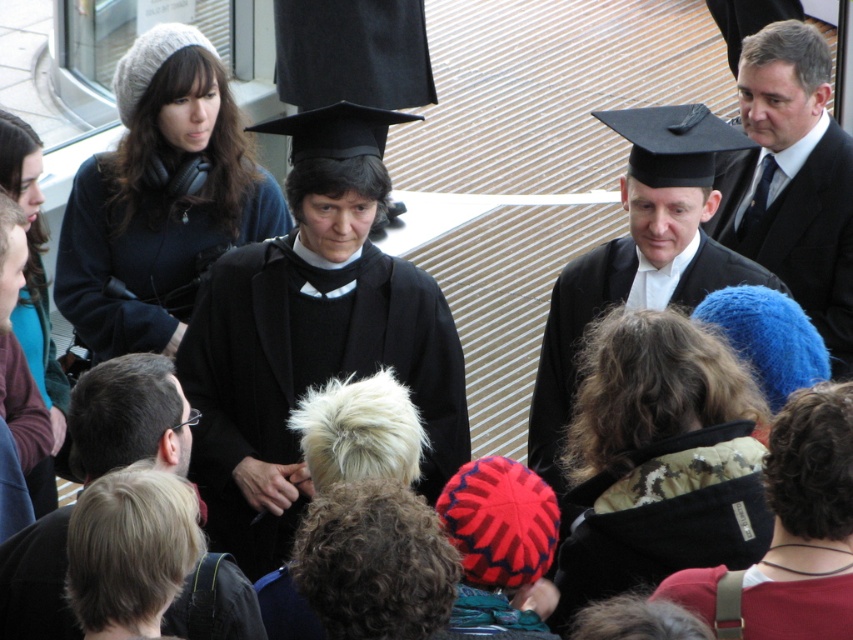
The image size is (853, 640). Describe the element at coordinates (306, 372) in the screenshot. I see `black matte robe at center` at that location.

This screenshot has width=853, height=640. What are the coordinates of `black matte robe at center` in the screenshot? It's located at (306, 372).

Which is below, black matte robe at center or black matte robe at upper center?

black matte robe at center is below.

What do you see at coordinates (306, 372) in the screenshot? I see `black matte robe at center` at bounding box center [306, 372].

Between point (223, 401) and point (62, 300), which one is positioned behind?

The point (62, 300) is more distant.

This screenshot has height=640, width=853. Find the location of `black matte robe at center`. black matte robe at center is located at coordinates (306, 372).

Does black matte suit at upper right appear over black matte robe at upper center?

Yes, black matte suit at upper right is above black matte robe at upper center.

Who is more distant from viewer, (816, 113) or (281, 208)?

The point (281, 208) is more distant.

You are a GUI agent. You are given a task and a screenshot of the screen. Output one action in this format:
    pyautogui.click(x=<x>, y=<y>)
    Task: Click on the black matte suit at upper right
    The height and width of the screenshot is (640, 853).
    Given the screenshot: What is the action you would take?
    pyautogui.click(x=793, y=179)